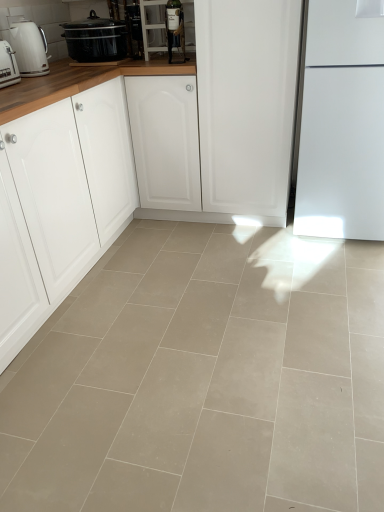
Question: Does beige tile floor at center have a greater width compared to white matte cabinet at left?

Choices:
 (A) yes
 (B) no

Answer: (A)

Question: Considering the relative sizes of beige tile floor at center and white matte cabinet at left in the image provided, is beige tile floor at center taller than white matte cabinet at left?

Choices:
 (A) no
 (B) yes

Answer: (A)

Question: Considering the relative positions of beige tile floor at center and white matte cabinet at left in the image provided, is beige tile floor at center to the right of white matte cabinet at left from the viewer's perspective?

Choices:
 (A) no
 (B) yes

Answer: (B)

Question: From a real-world perspective, is beige tile floor at center located higher than white matte cabinet at left?

Choices:
 (A) no
 (B) yes

Answer: (A)

Question: Is beige tile floor at center closer to camera compared to white matte cabinet at left?

Choices:
 (A) yes
 (B) no

Answer: (A)

Question: Does beige tile floor at center contain white matte cabinet at left?

Choices:
 (A) yes
 (B) no

Answer: (B)

Question: Does matte glass wine bottle at upper center, the first appliance viewed from the front, appear on the right side of matte black slow cooker at upper left?

Choices:
 (A) yes
 (B) no

Answer: (A)

Question: Is matte black slow cooker at upper left a part of matte glass wine bottle at upper center, the first appliance viewed from the front?

Choices:
 (A) yes
 (B) no

Answer: (B)

Question: Does matte glass wine bottle at upper center, arranged as the second appliance when viewed from the back, have a greater width compared to matte black slow cooker at upper left?

Choices:
 (A) yes
 (B) no

Answer: (B)

Question: Is matte glass wine bottle at upper center, placed as the 1th appliance when sorted from right to left, closer to camera compared to matte black slow cooker at upper left?

Choices:
 (A) yes
 (B) no

Answer: (A)

Question: Is matte glass wine bottle at upper center, placed as the 1th appliance when sorted from right to left, taller than matte black slow cooker at upper left?

Choices:
 (A) yes
 (B) no

Answer: (A)

Question: Is matte glass wine bottle at upper center, which ranks as the second appliance in left-to-right order, not close to matte black slow cooker at upper left?

Choices:
 (A) no
 (B) yes

Answer: (A)

Question: Does matte glass wine bottle at upper center, placed as the 1th appliance when sorted from right to left, appear on the left side of metallic glass bottle at upper center, the 1th appliance when ordered from left to right?

Choices:
 (A) yes
 (B) no

Answer: (B)